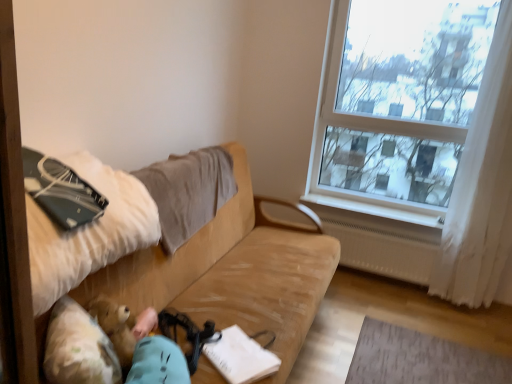
What are the coordinates of `vacant area that lies in front of white sheer curtain at right` in the screenshot? It's located at (465, 327).